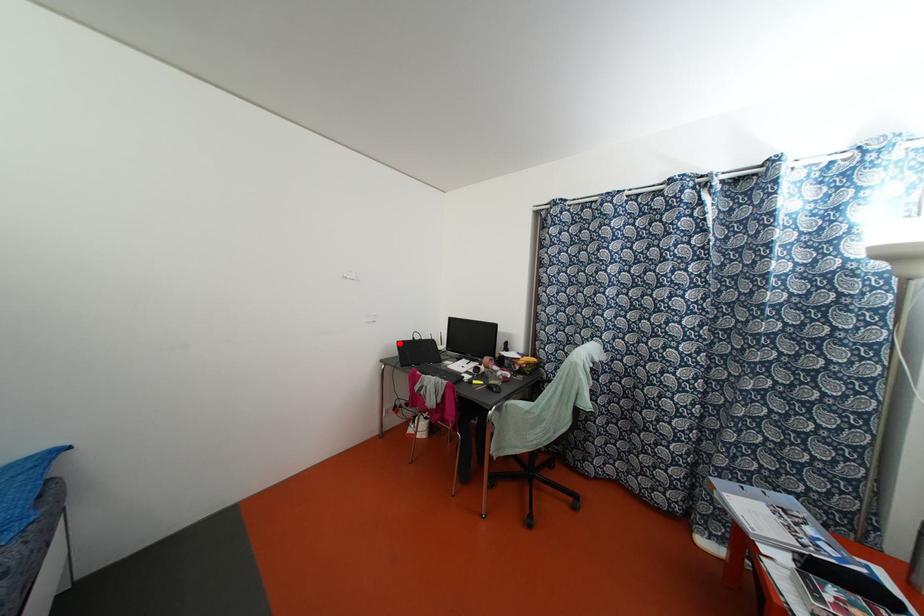
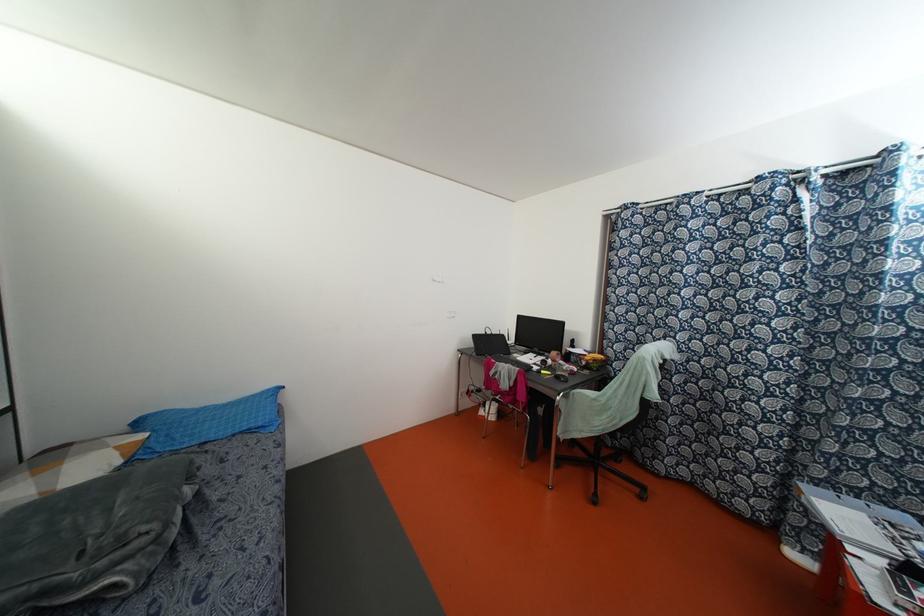
In the second image, find the point that corresponds to the highlighted location in the first image.

(473, 336)